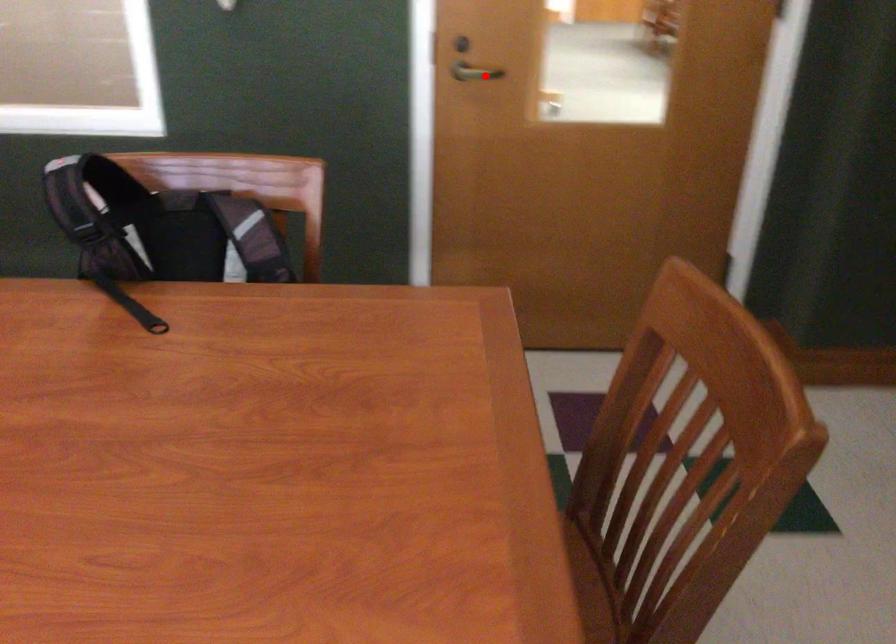
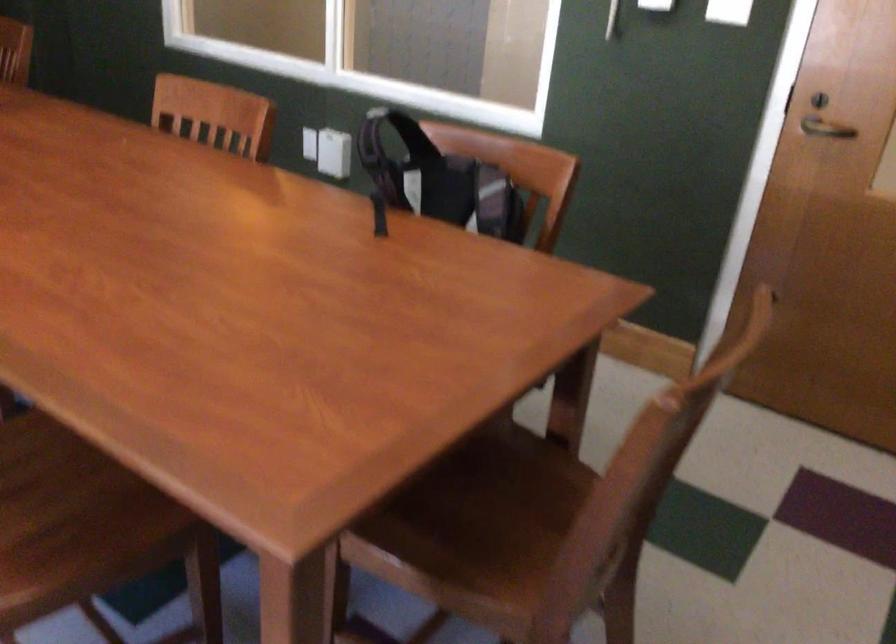
Where in the second image is the point corresponding to the highlighted location from the first image?

(824, 129)